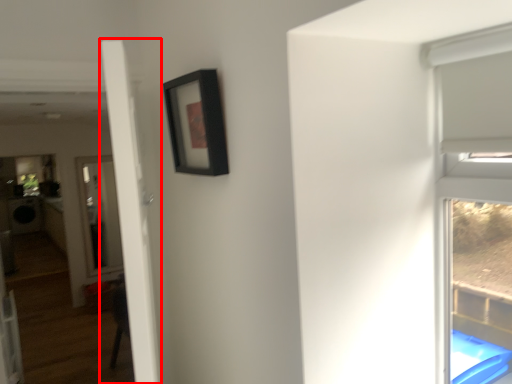
Question: Observing the image, what is the correct spatial positioning of door (annotated by the red box) in reference to picture frame?

Choices:
 (A) left
 (B) right

Answer: (A)